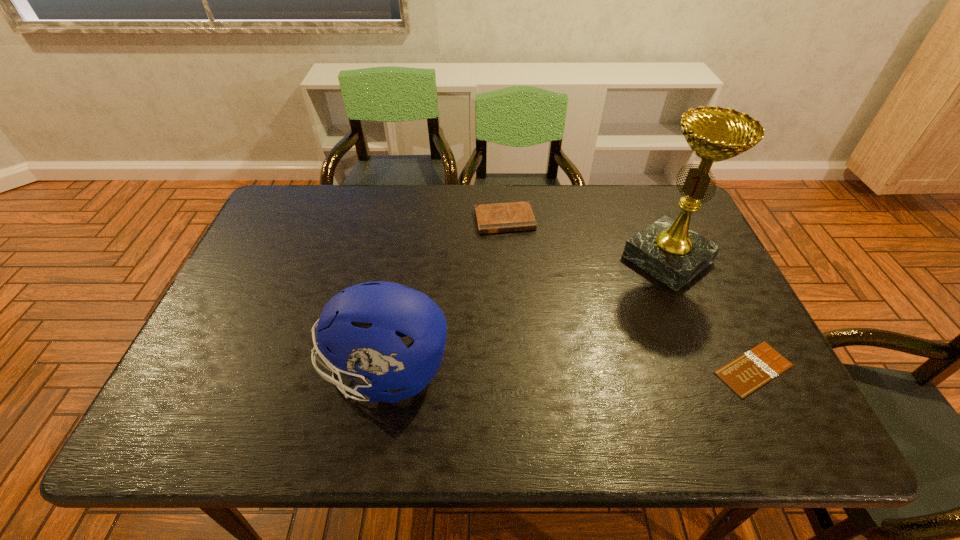
I want to click on free space located 0.140m on the front-facing side of the tallest object, so tap(607, 303).

Identify the location of free region located on the front-facing side of the tallest object. (588, 317).

Locate an element on the screen. This screenshot has height=540, width=960. free location located on the front-facing side of the tallest object is located at coordinates (591, 315).

At what (x,y) coordinates should I click in order to perform the action: click on vacant space situated 0.370m on the spine side of the second object from left to right. Please return your answer as a coordinate pair (x, y). The image size is (960, 540). Looking at the image, I should click on (534, 333).

Where is `vacant space located on the spine side of the second object from left to right`? The image size is (960, 540). vacant space located on the spine side of the second object from left to right is located at coordinates (x=529, y=311).

At what (x,y) coordinates should I click in order to perform the action: click on vacant space located on the spine side of the second object from left to right. Please return your answer as a coordinate pair (x, y). The height and width of the screenshot is (540, 960). Looking at the image, I should click on (520, 277).

At what (x,y) coordinates should I click in order to perform the action: click on award that is at the far edge. Please return your answer as a coordinate pair (x, y). The height and width of the screenshot is (540, 960). Looking at the image, I should click on (667, 249).

This screenshot has width=960, height=540. Find the location of `diary that is at the far edge`. diary that is at the far edge is located at coordinates pos(516,216).

The image size is (960, 540). I want to click on football helmet that is positioned at the near edge, so click(x=357, y=331).

The height and width of the screenshot is (540, 960). I want to click on chocolate bar present at the near edge, so click(748, 372).